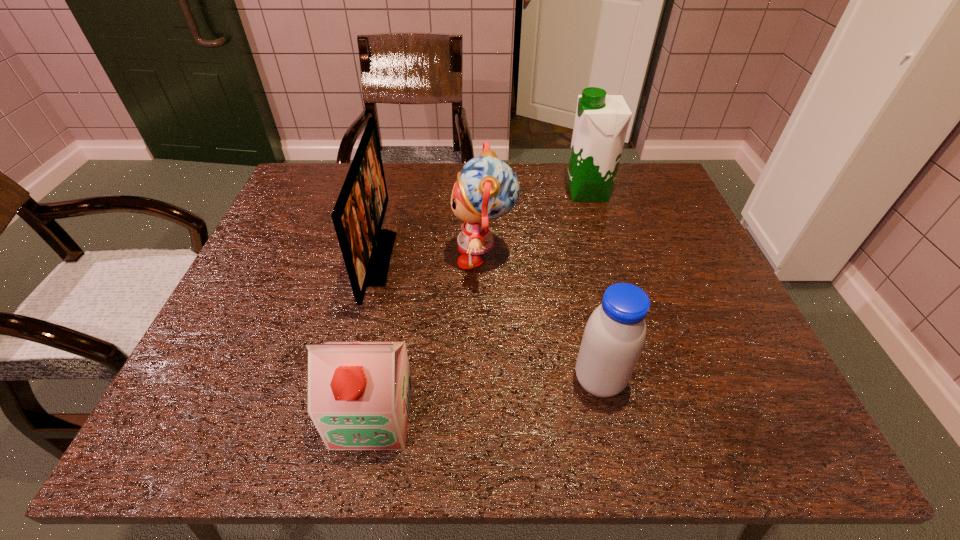
What are the coordinates of `free spot that satisfies the following two spatial constraints: 1. on the face of the third object from right to left; 2. with the cap open on the leftmost soya milk` in the screenshot? It's located at (486, 415).